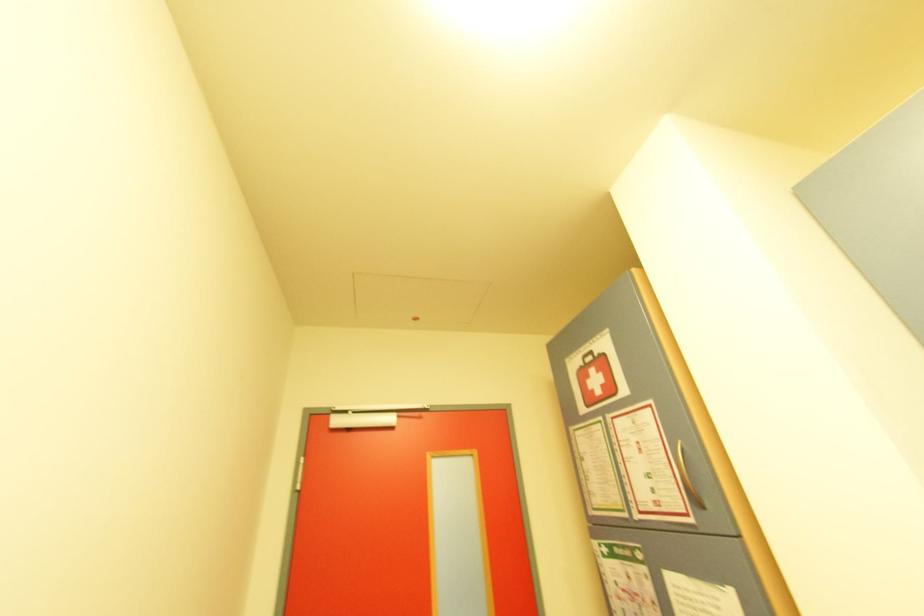
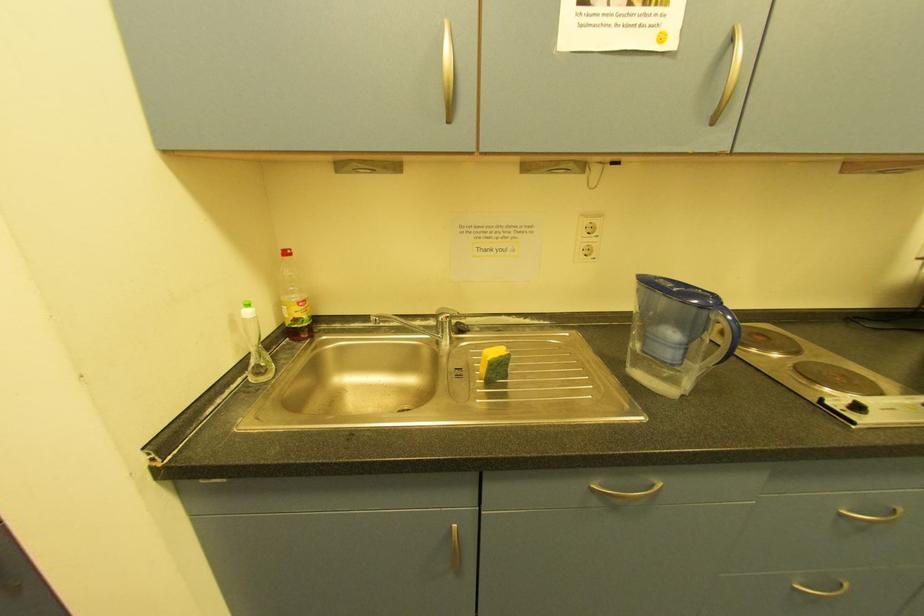
The first image is from the beginning of the video and the second image is from the end. How did the camera likely rotate when shooting the video?

The rotation direction of the camera is right-down.